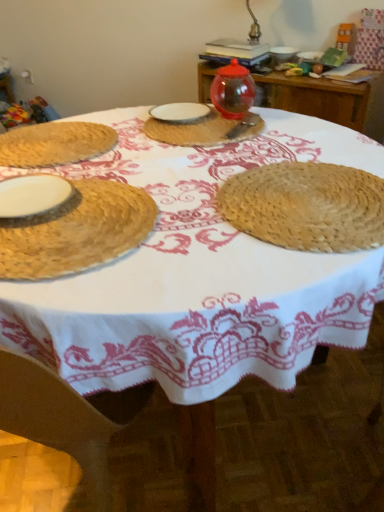
Question: Can you confirm if transparent glass jar at upper center, which is the fifth tableware from front to back, is bigger than white matte plate at left, the second tableware when ordered from bottom to top?

Choices:
 (A) yes
 (B) no

Answer: (A)

Question: Can you confirm if transparent glass jar at upper center, acting as the first tableware starting from the top, is smaller than white matte plate at left, positioned as the fourth tableware in top-to-bottom order?

Choices:
 (A) no
 (B) yes

Answer: (A)

Question: Is transparent glass jar at upper center, which is the fifth tableware from front to back, wider than white matte plate at left, the second tableware when ordered from bottom to top?

Choices:
 (A) no
 (B) yes

Answer: (A)

Question: Is transparent glass jar at upper center, which is the 1th tableware in back-to-front order, touching white matte plate at left, which is the 4th tableware in back-to-front order?

Choices:
 (A) no
 (B) yes

Answer: (A)

Question: Is transparent glass jar at upper center, which is the fifth tableware from front to back, behind white matte plate at left, positioned as the fourth tableware in top-to-bottom order?

Choices:
 (A) no
 (B) yes

Answer: (B)

Question: Can you confirm if transparent glass jar at upper center, which is counted as the 5th tableware, starting from the bottom, is shorter than white matte plate at left, positioned as the fourth tableware in top-to-bottom order?

Choices:
 (A) yes
 (B) no

Answer: (B)

Question: Is white matte plate at left, the second tableware when ordered from bottom to top, oriented away from transparent glass jar at upper center, acting as the first tableware starting from the top?

Choices:
 (A) no
 (B) yes

Answer: (A)

Question: Could you tell me if white matte plate at left, the second tableware when ordered from bottom to top, is turned towards transparent glass jar at upper center, acting as the first tableware starting from the top?

Choices:
 (A) no
 (B) yes

Answer: (A)

Question: From the image's perspective, is white matte plate at left, which ranks as the 2th tableware in front-to-back order, under transparent glass jar at upper center, acting as the first tableware starting from the top?

Choices:
 (A) no
 (B) yes

Answer: (B)

Question: Is white matte plate at left, the second tableware when ordered from bottom to top, not near transparent glass jar at upper center, which is the fifth tableware from front to back?

Choices:
 (A) yes
 (B) no

Answer: (A)

Question: Is white matte plate at left, the second tableware when ordered from bottom to top, directly adjacent to transparent glass jar at upper center, acting as the first tableware starting from the top?

Choices:
 (A) yes
 (B) no

Answer: (B)

Question: From a real-world perspective, is white matte plate at left, which is the 4th tableware in back-to-front order, positioned under transparent glass jar at upper center, acting as the first tableware starting from the top, based on gravity?

Choices:
 (A) no
 (B) yes

Answer: (A)

Question: Is white matte plate at left, positioned as the fourth tableware in top-to-bottom order, oriented towards natural straw placemat at left, which is the 5th tableware in back-to-front order?

Choices:
 (A) no
 (B) yes

Answer: (B)